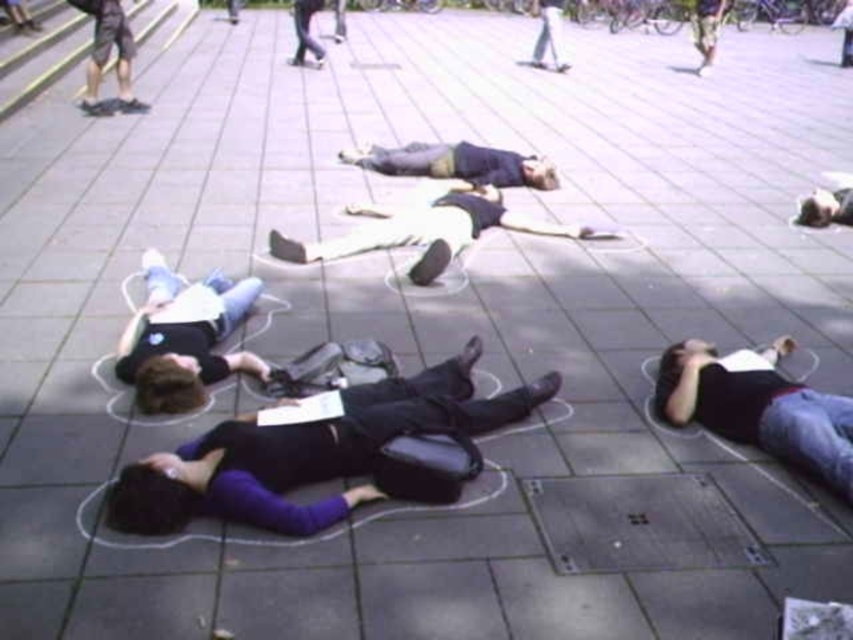
Based on the photo, between dark blue jeans at lower right and dark blue jeans at center, which one appears on the left side from the viewer's perspective?

dark blue jeans at center

You are a GUI agent. You are given a task and a screenshot of the screen. Output one action in this format:
    pyautogui.click(x=<x>, y=<y>)
    Task: Click on the dark blue jeans at lower right
    
    Given the screenshot: What is the action you would take?
    pyautogui.click(x=758, y=406)

Is purple matte shirt at center below dark blue jeans at center?

Yes.

Does point (265, 449) come in front of point (519, 179)?

Yes, point (265, 449) is in front of point (519, 179).

This screenshot has width=853, height=640. Describe the element at coordinates (309, 452) in the screenshot. I see `purple matte shirt at center` at that location.

I want to click on purple matte shirt at center, so click(x=309, y=452).

Does dark blue jeans at lower right appear on the right side of light beige pants at center?

Correct, you'll find dark blue jeans at lower right to the right of light beige pants at center.

Is point (728, 416) closer to viewer compared to point (502, 212)?

Yes.

Locate an element on the screen. dark blue jeans at lower right is located at coordinates (758, 406).